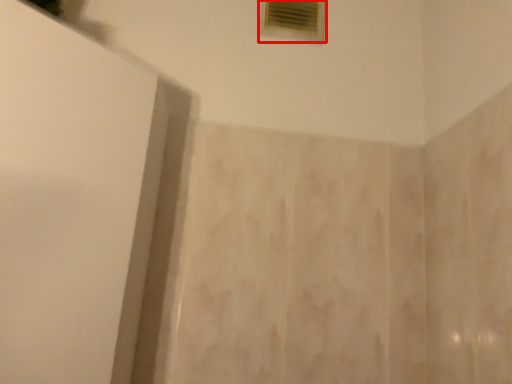
Question: In this image, where is window (annotated by the red box) located relative to screen door?

Choices:
 (A) right
 (B) left

Answer: (A)